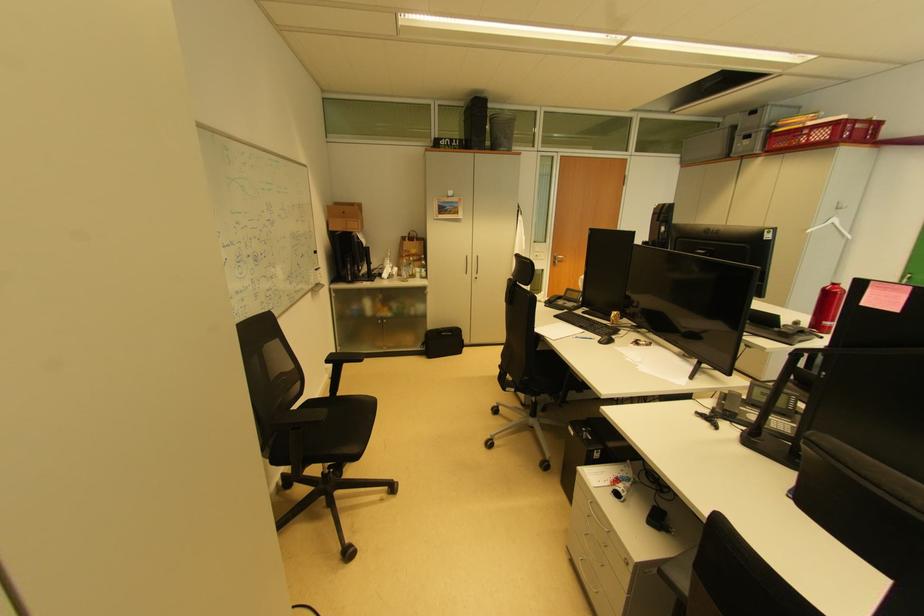
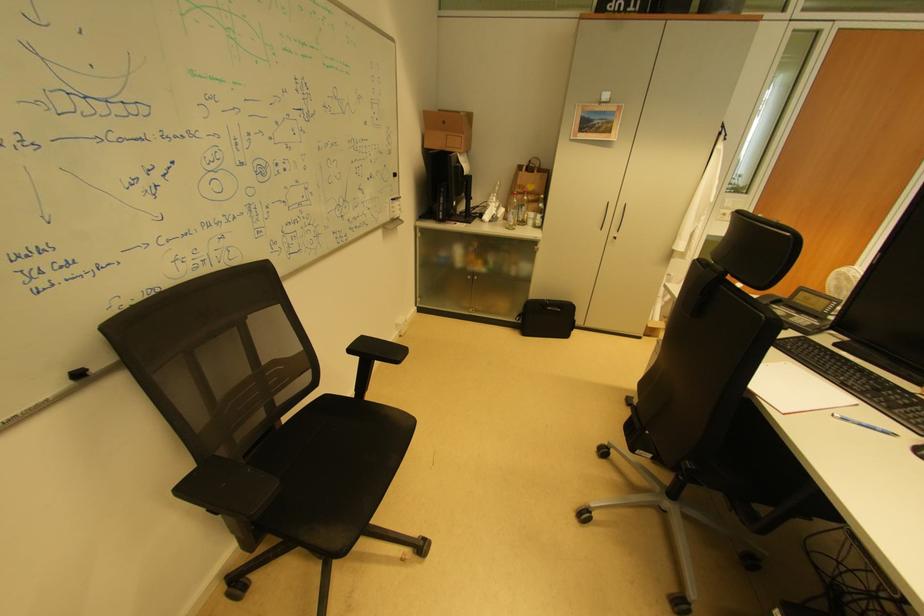
Question: The first image is from the beginning of the video and the second image is from the end. How did the camera likely rotate when shooting the video?

Choices:
 (A) Left
 (B) Right
 (C) Up
 (D) Down

Answer: (A)